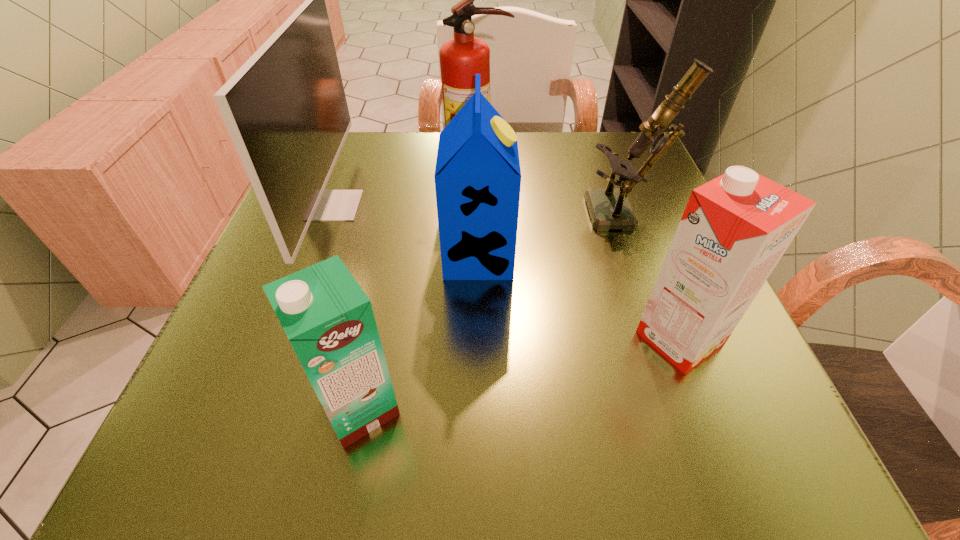
In order to click on object located at the far left corner in this screenshot , I will do `click(286, 111)`.

This screenshot has width=960, height=540. In order to click on free space at the far edge of the desktop in this screenshot , I will do `click(408, 153)`.

In the image, there is a desktop. Identify the location of vacant space at the left edge. This screenshot has height=540, width=960. (336, 232).

This screenshot has width=960, height=540. Find the location of `vacant space at the right edge`. vacant space at the right edge is located at coordinates (654, 193).

The height and width of the screenshot is (540, 960). I want to click on vacant space at the far left corner of the desktop, so click(350, 148).

This screenshot has width=960, height=540. In order to click on blank space at the far right corner of the desktop in this screenshot , I will do `click(607, 135)`.

Identify the location of blank area at the near right corner. (769, 459).

Locate an element on the screen. free spot between the microscope and the farthest carton is located at coordinates (552, 236).

The image size is (960, 540). I want to click on vacant area that lies between the rightmost carton and the farthest carton, so click(579, 297).

Locate an element on the screen. Image resolution: width=960 pixels, height=540 pixels. free space between the second carton from right to left and the leftmost object is located at coordinates (405, 231).